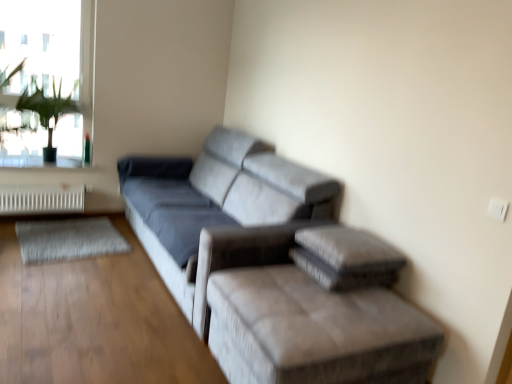
Question: Is green leafy plant at upper left to the left or to the right of velvet gray ottoman at lower right in the image?

Choices:
 (A) left
 (B) right

Answer: (A)

Question: Considering the positions of green leafy plant at upper left and velvet gray ottoman at lower right in the image, is green leafy plant at upper left bigger or smaller than velvet gray ottoman at lower right?

Choices:
 (A) small
 (B) big

Answer: (A)

Question: Which of these objects is positioned farthest from the suede gray couch at center?

Choices:
 (A) velvet gray ottoman at lower right
 (B) green leafy plant at upper left
 (C) white metallic radiator at lower left
 (D) transparent glass window at upper left

Answer: (D)

Question: Estimate the real-world distances between objects in this image. Which object is closer to the green leafy plant at upper left?

Choices:
 (A) velvet gray ottoman at lower right
 (B) transparent glass window at upper left
 (C) suede gray couch at center
 (D) white metallic radiator at lower left

Answer: (D)